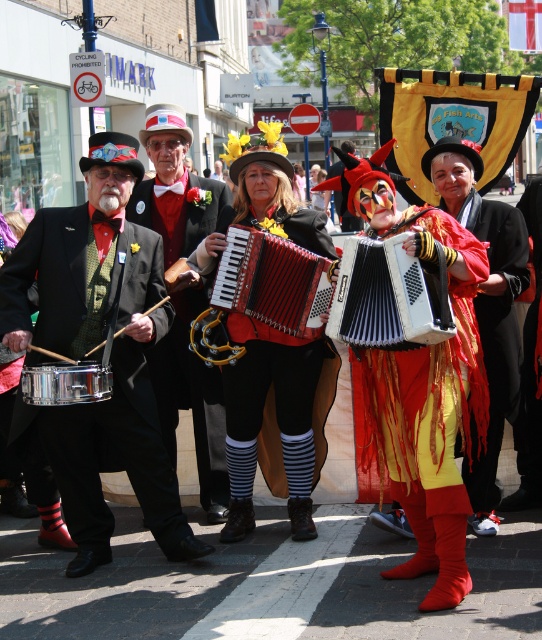
Question: Can you confirm if red velvet accordion at center is positioned to the left of brushed silver drum at lower left?

Choices:
 (A) no
 (B) yes

Answer: (A)

Question: Which object appears farthest from the camera in this image?

Choices:
 (A) matte black accordion at center
 (B) red velvet accordion at center

Answer: (A)

Question: Is matte black accordion at center further to the viewer compared to red velvet accordion at center?

Choices:
 (A) no
 (B) yes

Answer: (B)

Question: Which point is closer to the camera?

Choices:
 (A) flame-patterned costume at center
 (B) brushed silver drum at lower left
 (C) black leather accordion at center
 (D) white plastic accordion at center

Answer: (A)

Question: Is red velvet accordion at center closer to camera compared to black textured accordion at center?

Choices:
 (A) yes
 (B) no

Answer: (B)

Question: Which of the following is the farthest from the observer?

Choices:
 (A) (122, 320)
 (B) (493, 294)

Answer: (B)